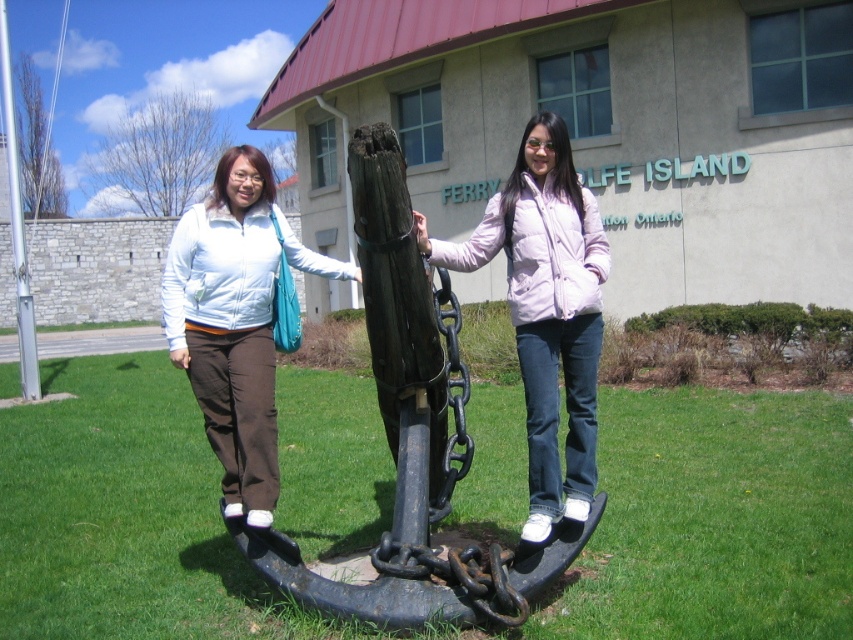
Which is below, green grass at center or light pink puffy jacket at center?

Positioned lower is green grass at center.

Based on the photo, between green grass at center and light pink puffy jacket at center, which one has more height?

With more height is light pink puffy jacket at center.

The width and height of the screenshot is (853, 640). What are the coordinates of `green grass at center` in the screenshot? It's located at (715, 518).

Can you confirm if light blue zip-up jacket at center is thinner than silver metallic pole at left?

Indeed, light blue zip-up jacket at center has a lesser width compared to silver metallic pole at left.

Which is behind, point (250, 387) or point (13, 241)?

Positioned behind is point (13, 241).

Locate an element on the screen. light blue zip-up jacket at center is located at coordinates (x=235, y=321).

Is light pink puffy jacket at center closer to the viewer compared to silver metallic pole at left?

Yes, it is.

Between light pink puffy jacket at center and silver metallic pole at left, which one appears on the left side from the viewer's perspective?

silver metallic pole at left is more to the left.

Which is in front, point (454, 268) or point (20, 230)?

Point (454, 268) is more forward.

The height and width of the screenshot is (640, 853). I want to click on light pink puffy jacket at center, so click(546, 308).